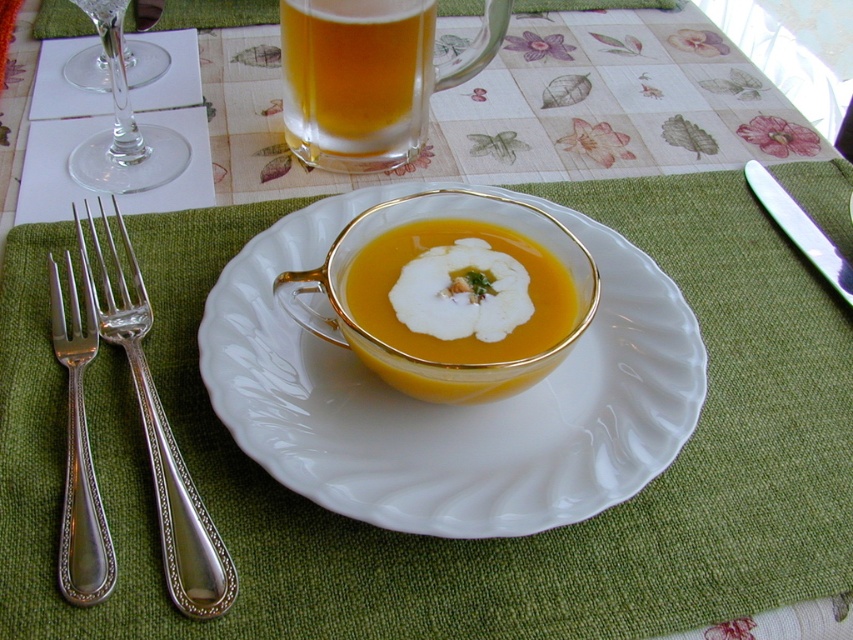
Question: Does golden glass bowl at center appear on the right side of silver/glossy fork at left?

Choices:
 (A) yes
 (B) no

Answer: (A)

Question: Considering the relative positions of golden glass bowl at center and yellow matte soup at center in the image provided, where is golden glass bowl at center located with respect to yellow matte soup at center?

Choices:
 (A) right
 (B) left

Answer: (B)

Question: Which object is farther from the camera taking this photo?

Choices:
 (A) white porcelain plate at center
 (B) silver/glossy fork at left
 (C) transparent glass wine glass at upper left

Answer: (C)

Question: Is golden glass beer at upper center smaller than transparent glass wine glass at left?

Choices:
 (A) yes
 (B) no

Answer: (A)

Question: Estimate the real-world distances between objects in this image. Which object is farther from the silver/glossy fork at left?

Choices:
 (A) transparent glass wine glass at left
 (B) yellow matte soup at center
 (C) white porcelain plate at center
 (D) silver polished knife at upper right

Answer: (D)

Question: Which object appears closest to the camera in this image?

Choices:
 (A) transparent glass wine glass at upper left
 (B) silver/glossy fork at left
 (C) silver polished knife at upper right

Answer: (B)